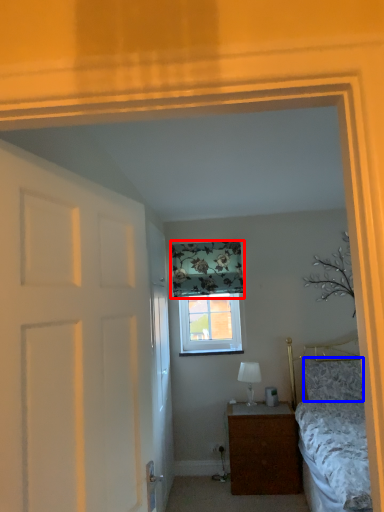
Question: Which object is further to the camera taking this photo, curtain (highlighted by a red box) or pillow (highlighted by a blue box)?

Choices:
 (A) curtain
 (B) pillow

Answer: (A)